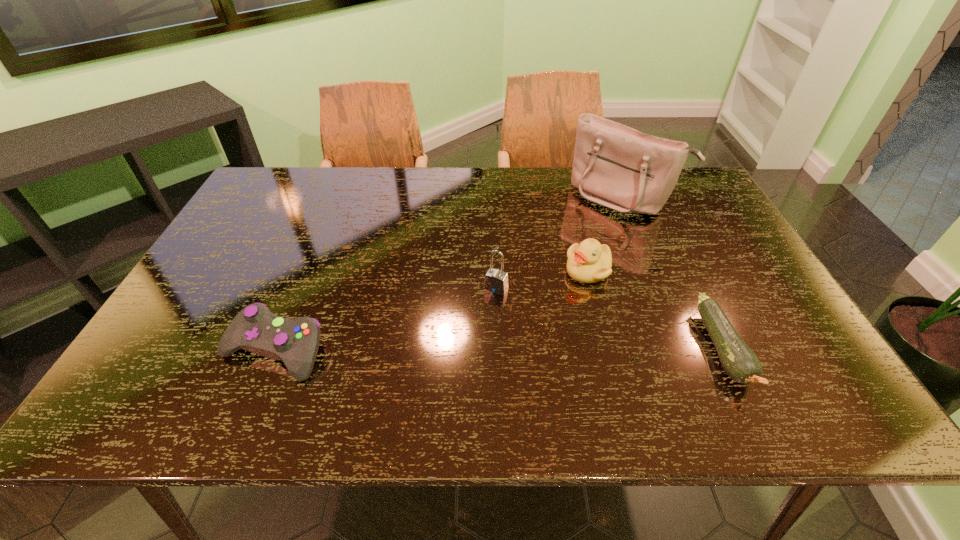
The image size is (960, 540). I want to click on zucchini at the near edge, so click(739, 361).

The image size is (960, 540). Identify the location of object located at the left edge. (255, 328).

Where is `zucchini present at the right edge`? zucchini present at the right edge is located at coordinates (739, 361).

Locate an element on the screen. The height and width of the screenshot is (540, 960). shoulder bag located at the right edge is located at coordinates (616, 166).

Where is `object located in the near left corner section of the desktop`? The height and width of the screenshot is (540, 960). object located in the near left corner section of the desktop is located at coordinates (255, 328).

The height and width of the screenshot is (540, 960). Identify the location of object that is at the far right corner. (616, 166).

Image resolution: width=960 pixels, height=540 pixels. Identify the location of object located in the near right corner section of the desktop. (739, 361).

At what (x,y) coordinates should I click in order to perform the action: click on free space at the far edge of the desktop. Please return your answer as a coordinate pair (x, y). Looking at the image, I should click on (338, 203).

Where is `vacant space at the near edge of the desktop`? This screenshot has width=960, height=540. vacant space at the near edge of the desktop is located at coordinates (594, 353).

The width and height of the screenshot is (960, 540). Identify the location of blank space at the left edge. (218, 268).